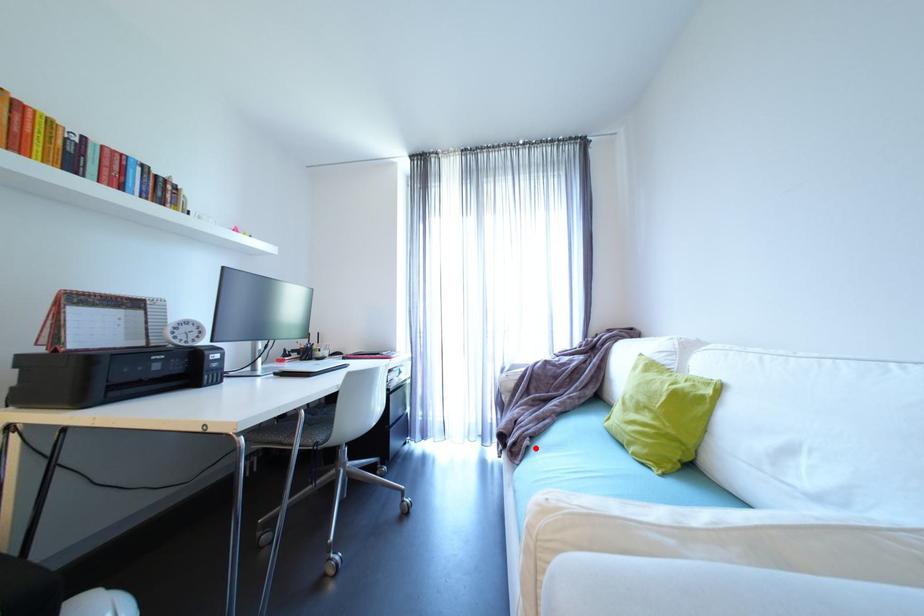
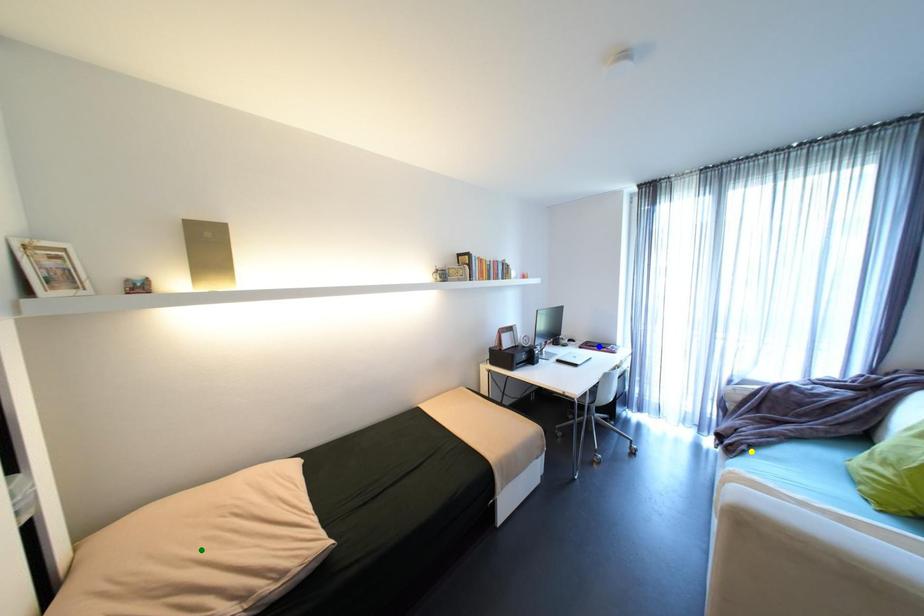
Question: I am providing you with two images of the same scene from different viewpoints. A red point is marked on the first image. You are given multiple points on the second image. Which point in image 2 represents the same 3d spot as the red point in image 1?

Choices:
 (A) green point
 (B) blue point
 (C) yellow point

Answer: (C)